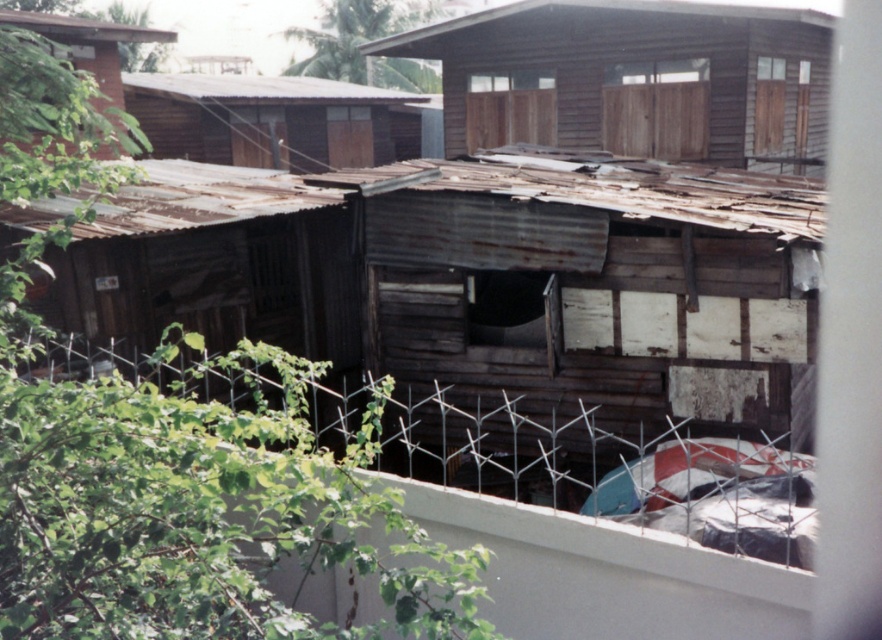
What do you see at coordinates (510, 449) in the screenshot? I see `metallic wire mesh at lower center` at bounding box center [510, 449].

Who is lower down, metallic wire mesh at lower center or wooden hut at upper center?

metallic wire mesh at lower center is below.

What do you see at coordinates (510, 449) in the screenshot? Image resolution: width=882 pixels, height=640 pixels. I see `metallic wire mesh at lower center` at bounding box center [510, 449].

Locate an element on the screen. Image resolution: width=882 pixels, height=640 pixels. metallic wire mesh at lower center is located at coordinates (510, 449).

Where is `rusty corrugated metal hut at center`? Image resolution: width=882 pixels, height=640 pixels. rusty corrugated metal hut at center is located at coordinates pyautogui.click(x=587, y=308).

From the picture: Does rusty corrugated metal hut at center have a lesser height compared to metallic wire mesh at lower center?

No, rusty corrugated metal hut at center is not shorter than metallic wire mesh at lower center.

You are a GUI agent. You are given a task and a screenshot of the screen. Output one action in this format:
    pyautogui.click(x=<x>, y=<y>)
    Task: Click on the rusty corrugated metal hut at center
    
    Given the screenshot: What is the action you would take?
    pyautogui.click(x=587, y=308)

I want to click on rusty corrugated metal hut at center, so click(587, 308).

In the scene shown: Which is below, metallic wire mesh at lower center or brown corrugated metal hut at upper left?

Positioned lower is metallic wire mesh at lower center.

Does point (132, 420) come farther from viewer compared to point (290, 145)?

That is False.

The image size is (882, 640). Identify the location of metallic wire mesh at lower center. [510, 449].